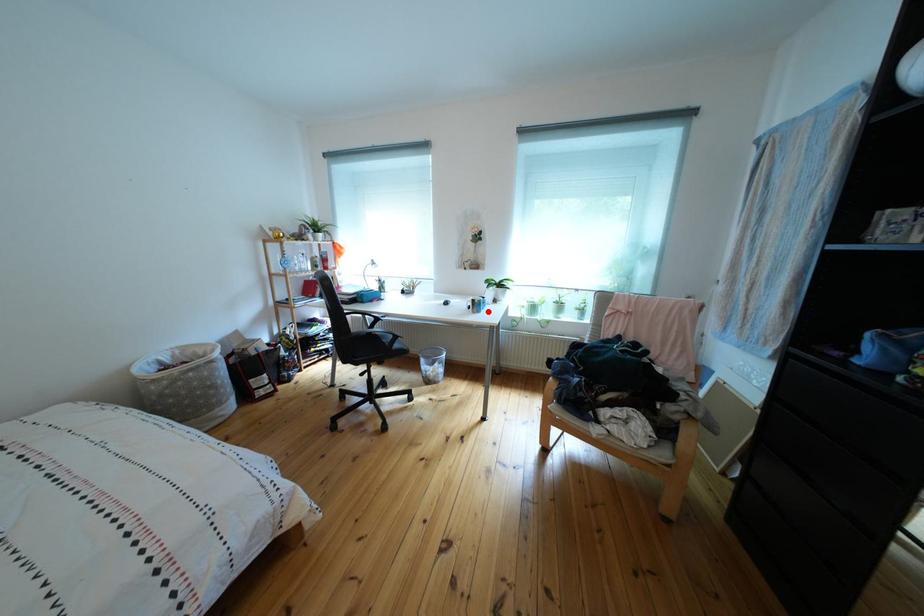
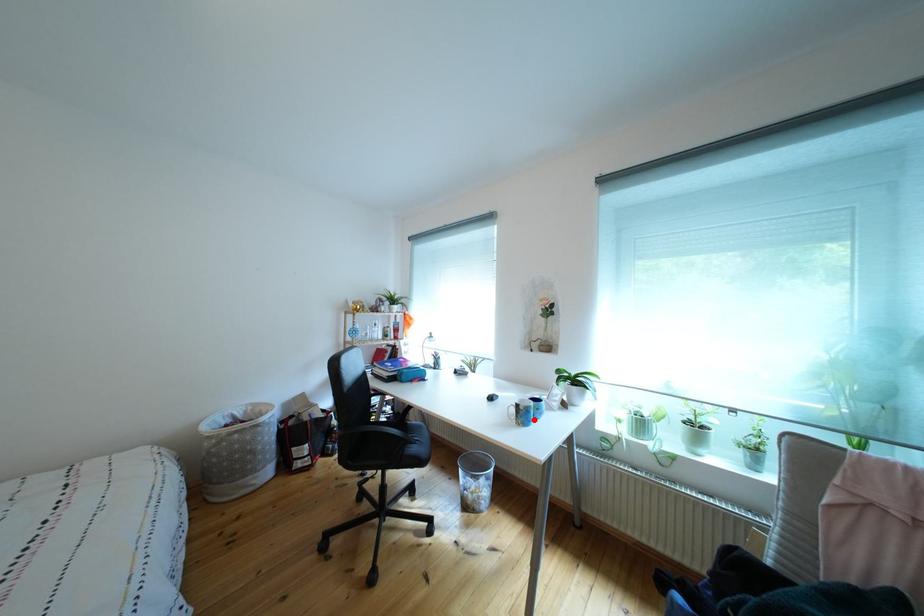
I am providing you with two images of the same scene from different viewpoints. A red point is marked on the first image and another point is marked on the second image. Are the points marked in image1 and image2 representing the same 3D position?

Yes